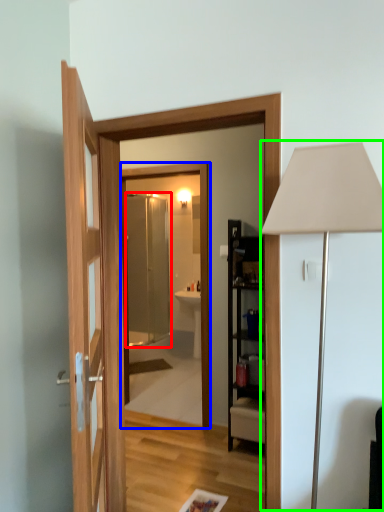
Question: Based on their relative distances, which object is nearer to screen door (highlighted by a red box)? Choose from mirror (highlighted by a blue box) and table lamp (highlighted by a green box).

Choices:
 (A) mirror
 (B) table lamp

Answer: (A)